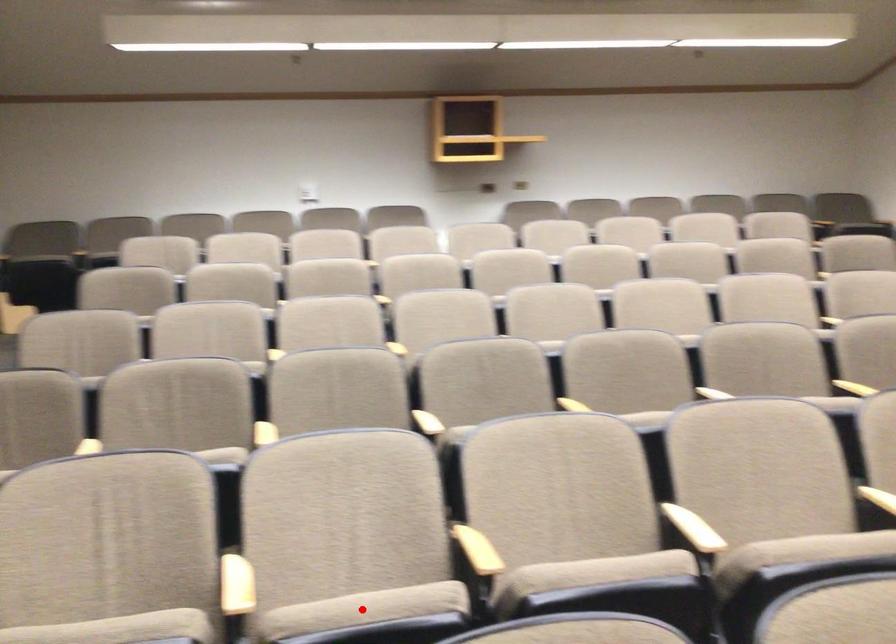
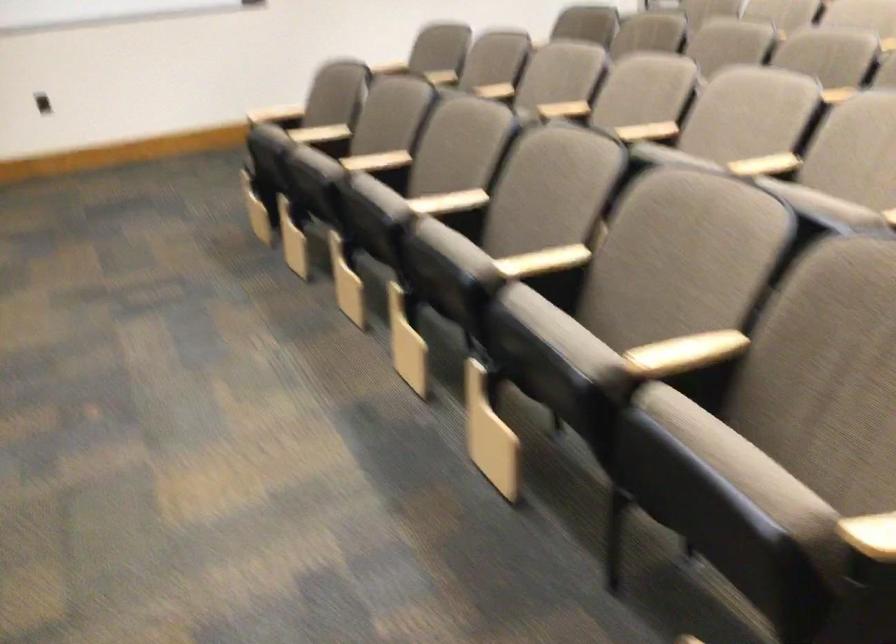
Question: I am providing you with two images of the same scene from different viewpoints. A red point is marked on the first image. At the location where the point appears in image 1, is it still visible in image 2?

Choices:
 (A) Yes
 (B) No

Answer: (B)